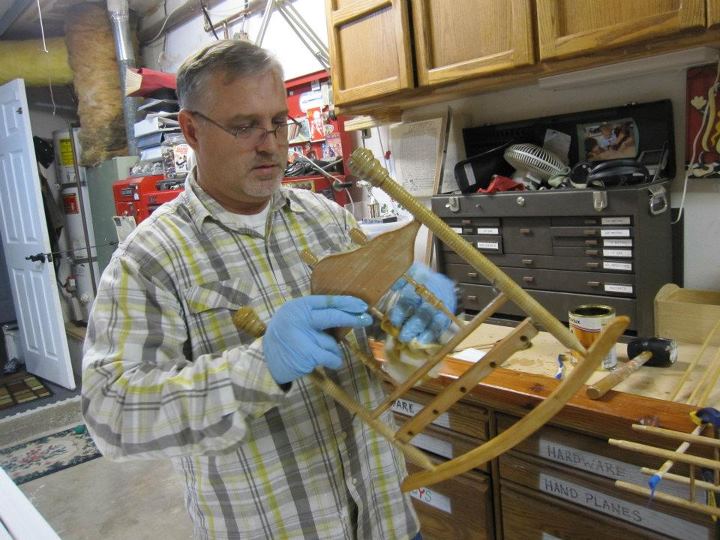
Locate an element on the screen. door is located at coordinates [53, 282].